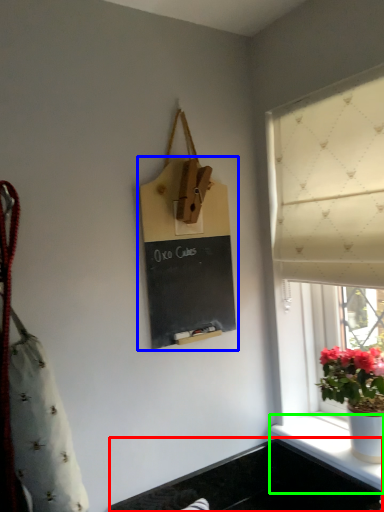
Question: Which is farther away from sink (highlighted by a red box)? bulletin board (highlighted by a blue box) or window sill (highlighted by a green box)?

Choices:
 (A) bulletin board
 (B) window sill

Answer: (A)